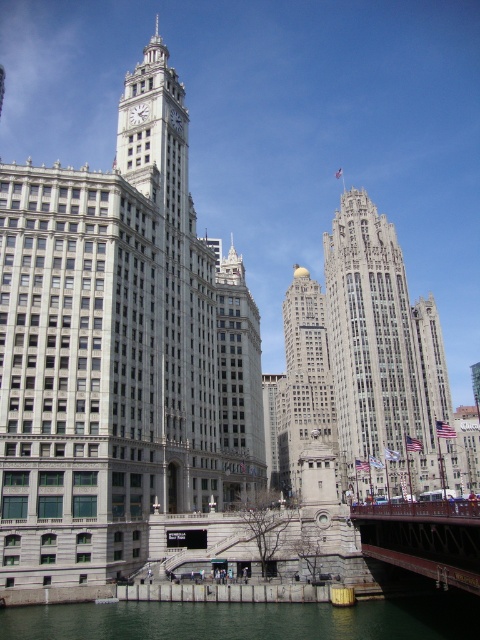
Is greenish water at lower center closer to the viewer compared to gold polished dome at center?

Yes, it is.

Is the position of greenish water at lower center more distant than that of gold polished dome at center?

No, greenish water at lower center is closer to the viewer.

Between point (210, 632) and point (304, 280), which one is positioned behind?

The point (304, 280) is behind.

What are the coordinates of `greenish water at lower center` in the screenshot? It's located at (250, 620).

In the scene shown: Does gray stone skyscraper at center appear on the left side of white stone clock tower at center?

In fact, gray stone skyscraper at center is to the right of white stone clock tower at center.

This screenshot has width=480, height=640. Describe the element at coordinates (382, 353) in the screenshot. I see `gray stone skyscraper at center` at that location.

Describe the element at coordinates (382, 353) in the screenshot. The height and width of the screenshot is (640, 480). I see `gray stone skyscraper at center` at that location.

The height and width of the screenshot is (640, 480). In order to click on gray stone skyscraper at center in this screenshot , I will do `click(382, 353)`.

Is greenish water at lower center wider than metallic red bridge at lower right?

Yes.

Who is higher up, greenish water at lower center or metallic red bridge at lower right?

metallic red bridge at lower right is higher up.

Locate an element on the screen. The image size is (480, 640). greenish water at lower center is located at coordinates (250, 620).